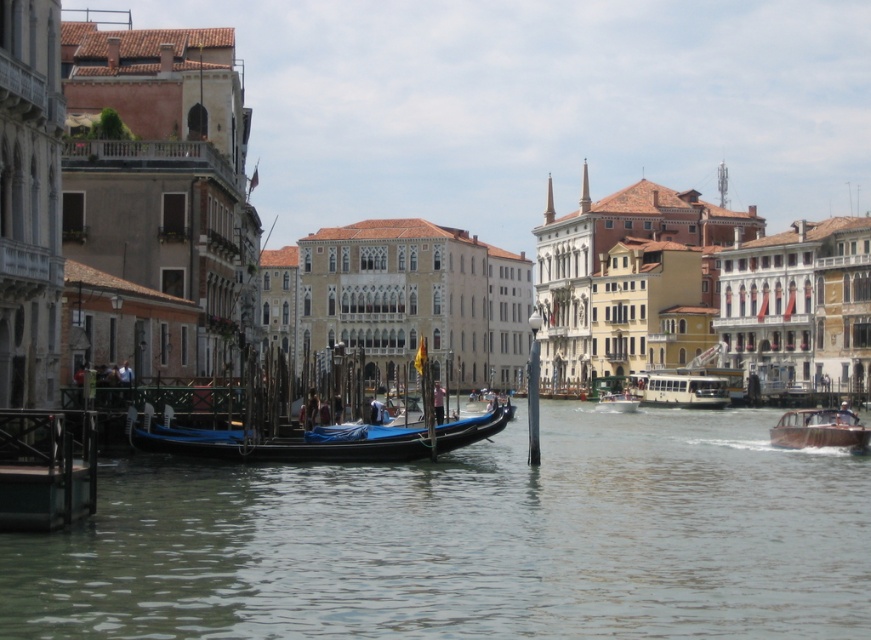
Question: Is clear water at lower center below blue polished wood gondola at center?

Choices:
 (A) yes
 (B) no

Answer: (A)

Question: Does wooden polished boat at right appear under white plastic boat at center?

Choices:
 (A) yes
 (B) no

Answer: (A)

Question: Considering the real-world distances, which object is farthest from the wooden polished boat at right?

Choices:
 (A) white glossy bus at center
 (B) blue polished wood gondola at center

Answer: (B)

Question: Which object appears farthest from the camera in this image?

Choices:
 (A) wooden polished boat at right
 (B) white plastic boat at center

Answer: (B)

Question: Considering the real-world distances, which object is farthest from the clear water at lower center?

Choices:
 (A) blue polished wood gondola at center
 (B) white glossy bus at center
 (C) wooden polished boat at right

Answer: (B)

Question: Does blue polished wood gondola at center have a smaller size compared to wooden polished boat at right?

Choices:
 (A) yes
 (B) no

Answer: (A)